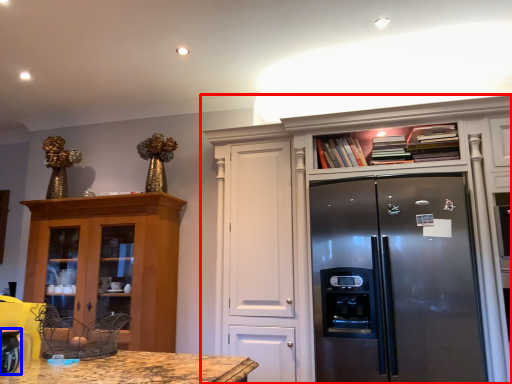
Question: Which of the following is the farthest to the observer, cabinetry (highlighted by a red box) or appliance (highlighted by a blue box)?

Choices:
 (A) cabinetry
 (B) appliance

Answer: (A)